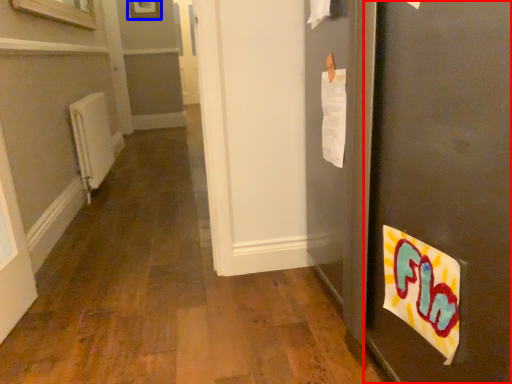
Question: Which of the following is the closest to the observer, door (highlighted by a red box) or picture frame (highlighted by a blue box)?

Choices:
 (A) door
 (B) picture frame

Answer: (A)